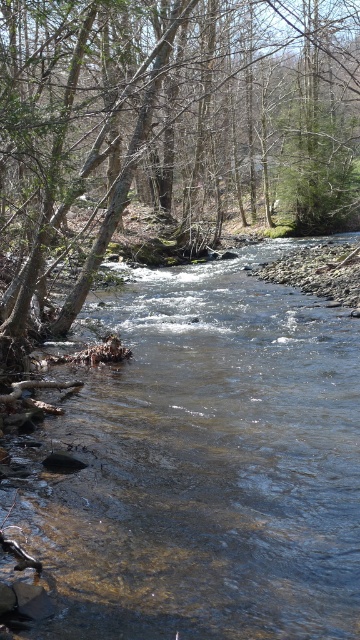
Question: Among these objects, which one is farthest from the camera?

Choices:
 (A) brown bark tree at left
 (B) clear water stream at center

Answer: (A)

Question: Which point is farther to the camera?

Choices:
 (A) (312, 506)
 (B) (24, 122)

Answer: (A)

Question: Is clear water stream at center to the left of brown bark tree at left from the viewer's perspective?

Choices:
 (A) no
 (B) yes

Answer: (B)

Question: Can you confirm if clear water stream at center is positioned above brown bark tree at left?

Choices:
 (A) no
 (B) yes

Answer: (A)

Question: Among these objects, which one is farthest from the camera?

Choices:
 (A) brown bark tree at left
 (B) clear water stream at center

Answer: (A)

Question: Can you confirm if clear water stream at center is thinner than brown bark tree at left?

Choices:
 (A) no
 (B) yes

Answer: (B)